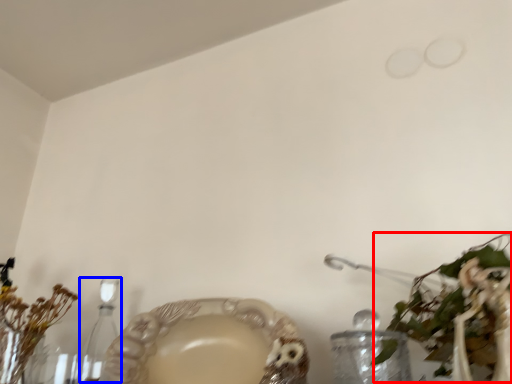
Question: Which object appears closest to the camera in this image, floral arrangement (highlighted by a red box) or candle holder (highlighted by a blue box)?

Choices:
 (A) floral arrangement
 (B) candle holder

Answer: (A)